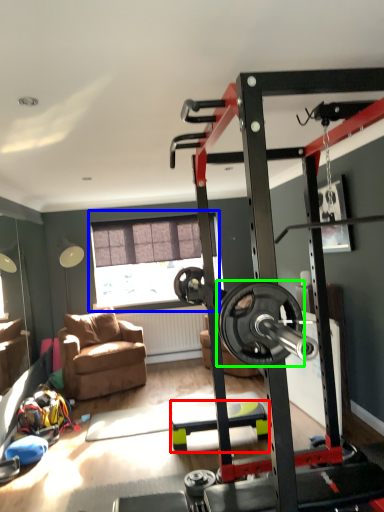
Question: Which object is positioned farthest from furniture (highlighted by a red box)? Select from window (highlighted by a blue box) and wheel (highlighted by a green box).

Choices:
 (A) window
 (B) wheel

Answer: (B)